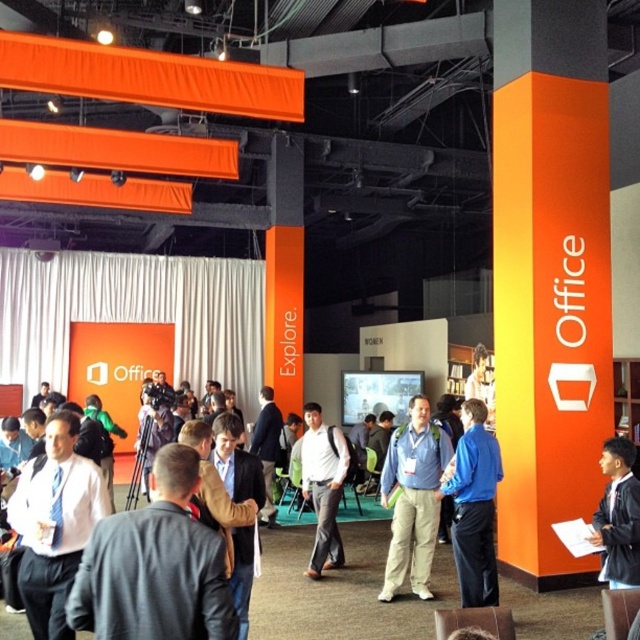
Question: Can you confirm if matte blue tie at center is positioned to the right of dark blue suit at lower right?

Choices:
 (A) no
 (B) yes

Answer: (A)

Question: Which object appears farthest from the camera in this image?

Choices:
 (A) matte blue tie at center
 (B) blue fabric backpack at center
 (C) gray fabric jacket at center
 (D) blue fabric shirt at center

Answer: (B)

Question: Can you confirm if gray fabric jacket at center is positioned below matte blue tie at center?

Choices:
 (A) yes
 (B) no

Answer: (B)

Question: Which point is farther to the camera?

Choices:
 (A) gray fabric jacket at center
 (B) dark blue suit at lower right
 (C) matte blue tie at center
 (D) blue fabric shirt at center

Answer: (D)

Question: Can you confirm if blue fabric backpack at center is wider than blue fabric shirt at center?

Choices:
 (A) yes
 (B) no

Answer: (A)

Question: Which of the following is the farthest from the observer?

Choices:
 (A) [157, 532]
 (B) [428, 460]
 (C) [625, 509]
 (D) [310, 470]

Answer: (D)